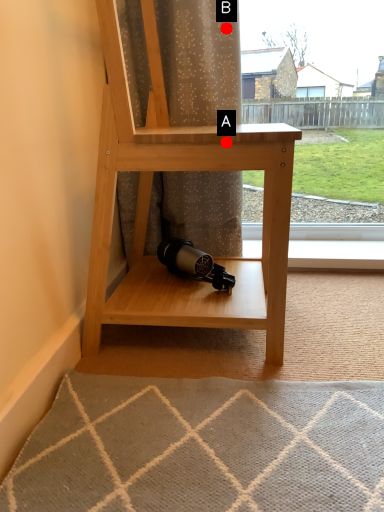
Question: Two points are circled on the image, labeled by A and B beside each circle. Which point is closer to the camera?

Choices:
 (A) A is closer
 (B) B is closer

Answer: (A)